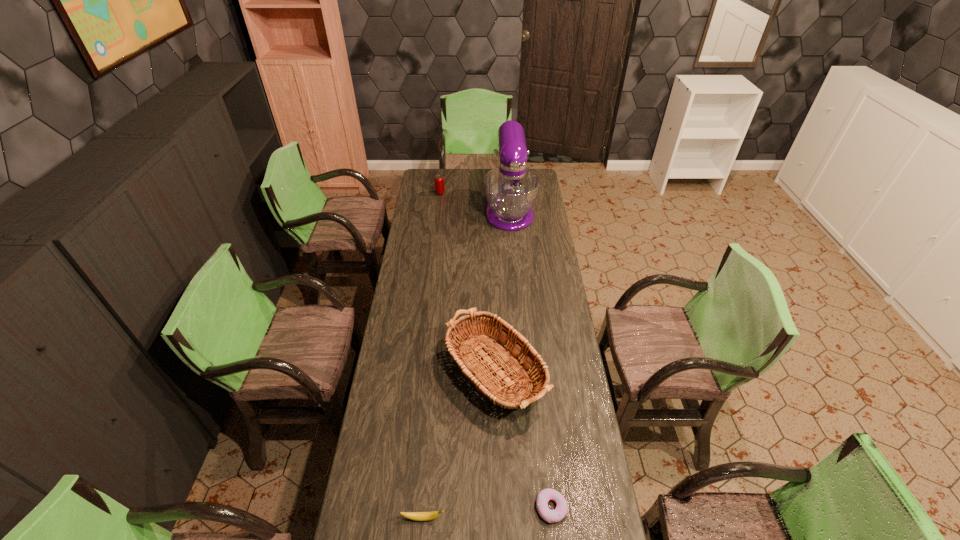
Find the location of a particular element. The image size is (960, 540). the tallest object is located at coordinates (511, 190).

Locate an element on the screen. the third nearest object is located at coordinates [502, 346].

At what (x,y) coordinates should I click in order to perform the action: click on the second tallest object. Please return your answer as a coordinate pair (x, y). The height and width of the screenshot is (540, 960). Looking at the image, I should click on (502, 346).

You are a GUI agent. You are given a task and a screenshot of the screen. Output one action in this format:
    pyautogui.click(x=<x>, y=<y>)
    Task: Click on the can
    The height and width of the screenshot is (540, 960).
    Given the screenshot: What is the action you would take?
    pyautogui.click(x=439, y=179)

Where is `the fourth tallest object`? The width and height of the screenshot is (960, 540). the fourth tallest object is located at coordinates (417, 516).

Identify the location of the shortest object. This screenshot has width=960, height=540. (551, 516).

You are a GUI agent. You are given a task and a screenshot of the screen. Output one action in this format:
    pyautogui.click(x=<x>, y=<y>)
    Task: Click on the vacant space located at the bowl opening of the tallest object
    Image resolution: width=960 pixels, height=540 pixels.
    Given the screenshot: What is the action you would take?
    pyautogui.click(x=515, y=275)

Locate an element on the screen. The height and width of the screenshot is (540, 960). vacant area located 0.070m on the left of the basket is located at coordinates (400, 364).

Identify the location of free space located 0.060m on the left of the can. (425, 193).

This screenshot has width=960, height=540. I want to click on free space located at the stem of the fourth tallest object, so click(x=482, y=518).